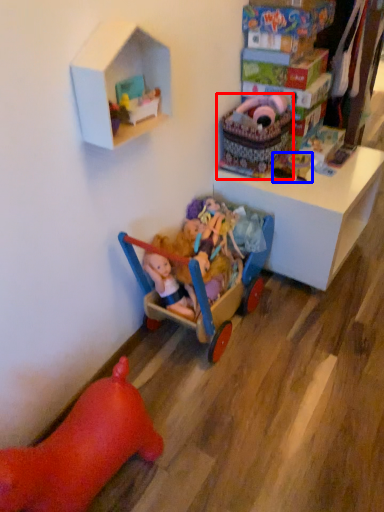
Question: Which object appears closest to the camera in this image, toy (highlighted by a red box) or toy (highlighted by a blue box)?

Choices:
 (A) toy
 (B) toy

Answer: (A)